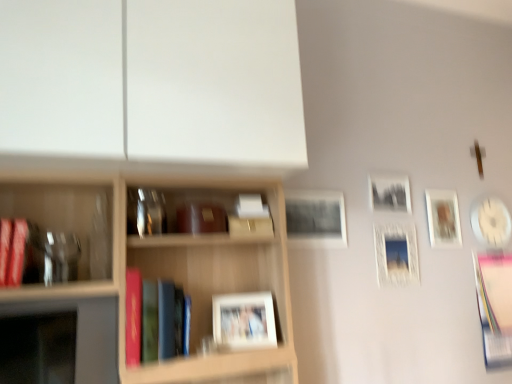
Locate an element on the screen. Image resolution: width=512 pixels, height=384 pixels. matte wooden picture frame at upper right, marked as the 2th picture frame in a right-to-left arrangement is located at coordinates (443, 218).

Locate an element on the screen. Image resolution: width=512 pixels, height=384 pixels. wooden shelf at upper left is located at coordinates (151, 85).

Where is `pink paper book at right, the 1th book in the right-to-left sequence`? The image size is (512, 384). pink paper book at right, the 1th book in the right-to-left sequence is located at coordinates (495, 307).

The width and height of the screenshot is (512, 384). Identify the location of hardcover book at center, which ranks as the second book in left-to-right order. click(x=155, y=319).

Where is `matte wooden picture frame at upper right, marked as the 5th picture frame in a front-to-back arrangement`? This screenshot has width=512, height=384. matte wooden picture frame at upper right, marked as the 5th picture frame in a front-to-back arrangement is located at coordinates (443, 218).

Identify the location of picture frame that is the 3rd object located above the matte white picture frame at center, acting as the first picture frame starting from the left (from the image's perspective). (443, 218).

Is matte white picture frame at center, acting as the first picture frame starting from the left, looking in the opposite direction of matte wooden picture frame at upper right, which is the 2th picture frame in back-to-front order?

No.

Between matte white picture frame at center, the sixth picture frame positioned from the back, and matte wooden picture frame at upper right, marked as the 2th picture frame in a right-to-left arrangement, which one has less height?

matte white picture frame at center, the sixth picture frame positioned from the back, is shorter.

Looking at this image, is matte white picture frame at center, acting as the first picture frame starting from the left, not close to matte wooden picture frame at upper right, marked as the 5th picture frame in a front-to-back arrangement?

Yes.

Which is closer, (478, 214) or (323, 232)?

Positioned in front is point (323, 232).

Consider the image. From a real-world perspective, which is physically above, white glossy picture frame at upper right, the 6th picture frame when ordered from front to back, or matte black picture frame at center, which is the second picture frame from front to back?

matte black picture frame at center, which is the second picture frame from front to back, from a real-world perspective.

Does white glossy picture frame at upper right, the first picture frame viewed from the right, have a greater height compared to matte black picture frame at center, which is the fifth picture frame in back-to-front order?

Yes, white glossy picture frame at upper right, the first picture frame viewed from the right, is taller than matte black picture frame at center, which is the fifth picture frame in back-to-front order.

Does white glossy picture frame at upper right, which appears as the 6th picture frame when viewed from the left, turn towards matte black picture frame at center, which is the second picture frame from front to back?

No.

From the image's perspective, is matte wooden picture frame at upper right, positioned as the 5th picture frame in left-to-right order, above matte white picture frame at center, placed as the first picture frame when sorted from front to back?

Yes, from the image's perspective, matte wooden picture frame at upper right, positioned as the 5th picture frame in left-to-right order, is on top of matte white picture frame at center, placed as the first picture frame when sorted from front to back.

Does matte wooden picture frame at upper right, marked as the 5th picture frame in a front-to-back arrangement, lie behind matte white picture frame at center, the sixth picture frame positioned from the back?

That is True.

Between matte wooden picture frame at upper right, marked as the 5th picture frame in a front-to-back arrangement, and matte white picture frame at center, placed as the first picture frame when sorted from front to back, which one appears on the left side from the viewer's perspective?

matte white picture frame at center, placed as the first picture frame when sorted from front to back.

From a real-world perspective, which is physically above, black matte picture frame at upper right, placed as the third picture frame when sorted from left to right, or pink paper book at right, the third book viewed from the left?

black matte picture frame at upper right, placed as the third picture frame when sorted from left to right, from a real-world perspective.

Which is more to the right, black matte picture frame at upper right, marked as the 4th picture frame in a right-to-left arrangement, or pink paper book at right, the 1th book in the right-to-left sequence?

pink paper book at right, the 1th book in the right-to-left sequence.

In the scene shown: How different are the orientations of black matte picture frame at upper right, marked as the third picture frame in a back-to-front arrangement, and pink paper book at right, the third book viewed from the left, in degrees?

0.927 degrees.

Would you say pink paper book at right, the 1th book in the right-to-left sequence, is part of black matte picture frame at upper right, which ranks as the fourth picture frame in front-to-back order,'s contents?

That's incorrect, pink paper book at right, the 1th book in the right-to-left sequence, is not inside black matte picture frame at upper right, which ranks as the fourth picture frame in front-to-back order.

Measure the distance from matte red book at left, arranged as the first book when viewed from the left, to black matte picture frame at upper right, marked as the 4th picture frame in a right-to-left arrangement.

The distance of matte red book at left, arranged as the first book when viewed from the left, from black matte picture frame at upper right, marked as the 4th picture frame in a right-to-left arrangement, is 1.52 meters.

From the image's perspective, is matte red book at left, arranged as the first book when viewed from the left, below black matte picture frame at upper right, marked as the third picture frame in a back-to-front arrangement?

Answer: Correct, matte red book at left, arranged as the first book when viewed from the left, appears lower than black matte picture frame at upper right, marked as the third picture frame in a back-to-front arrangement, in the image.

Can you confirm if matte red book at left, marked as the first book in a front-to-back arrangement, is positioned to the right of black matte picture frame at upper right, marked as the 4th picture frame in a right-to-left arrangement?

No, matte red book at left, marked as the first book in a front-to-back arrangement, is not to the right of black matte picture frame at upper right, marked as the 4th picture frame in a right-to-left arrangement.

Is matte red book at left, the third book viewed from the back, in front of or behind black matte picture frame at upper right, placed as the third picture frame when sorted from left to right, in the image?

Clearly, matte red book at left, the third book viewed from the back, is in front of black matte picture frame at upper right, placed as the third picture frame when sorted from left to right.

Which is in front, point (446, 229) or point (504, 246)?

Point (446, 229)

Considering the sizes of objects matte wooden picture frame at upper right, positioned as the 5th picture frame in left-to-right order, and white glossy picture frame at upper right, the 6th picture frame when ordered from front to back, in the image provided, who is wider, matte wooden picture frame at upper right, positioned as the 5th picture frame in left-to-right order, or white glossy picture frame at upper right, the 6th picture frame when ordered from front to back,?

white glossy picture frame at upper right, the 6th picture frame when ordered from front to back, is wider.

Is matte wooden picture frame at upper right, marked as the 5th picture frame in a front-to-back arrangement, oriented away from white glossy picture frame at upper right, the first picture frame viewed from the right?

matte wooden picture frame at upper right, marked as the 5th picture frame in a front-to-back arrangement, does not have its back to white glossy picture frame at upper right, the first picture frame viewed from the right.

Is white glossy picture frame at upper right, the 6th picture frame when ordered from front to back, a part of matte wooden picture frame at upper right, positioned as the 5th picture frame in left-to-right order?

No, white glossy picture frame at upper right, the 6th picture frame when ordered from front to back, is located outside of matte wooden picture frame at upper right, positioned as the 5th picture frame in left-to-right order.

In terms of size, does pink paper book at right, marked as the first book in a back-to-front arrangement, appear bigger or smaller than matte white picture frame at center, acting as the first picture frame starting from the left?

In the image, pink paper book at right, marked as the first book in a back-to-front arrangement, appears to be larger than matte white picture frame at center, acting as the first picture frame starting from the left.

Is pink paper book at right, the 1th book in the right-to-left sequence, to the left or to the right of matte white picture frame at center, acting as the sixth picture frame starting from the right, in the image?

pink paper book at right, the 1th book in the right-to-left sequence, is positioned on matte white picture frame at center, acting as the sixth picture frame starting from the right,'s right side.

Which point is more distant from viewer, (500,265) or (233,306)?

The point (500,265) is farther from the camera.

From a real-world perspective, count 3rd picture frames downward from the matte wooden picture frame at upper right, positioned as the 5th picture frame in left-to-right order, and point to it. Please provide its 2D coordinates.

[(244, 320)]

I want to click on picture frame that is the 2nd object located above the white glossy picture frame at upper right, which appears as the 6th picture frame when viewed from the left (from the image's perspective), so click(x=315, y=219).

Which object lies further to the anchor point pink paper book at right, the 1th book in the right-to-left sequence, matte black picture frame at center, which is the fifth picture frame in back-to-front order, or wooden shelf at upper left?

wooden shelf at upper left lies further to pink paper book at right, the 1th book in the right-to-left sequence, than the other object.

When comparing their distances from white glossy picture frame at upper right, which appears as the 6th picture frame when viewed from the left, does wooden shelf at upper left or hardcover book at center, which ranks as the 2th book in front-to-back order, seem closer?

Based on the image, wooden shelf at upper left appears to be nearer to white glossy picture frame at upper right, which appears as the 6th picture frame when viewed from the left.

Based on their spatial positions, is pink paper book at right, the third book viewed from the left, or wooden shelf at upper left further from hardcover book at center, which ranks as the 2th book in front-to-back order?

A: pink paper book at right, the third book viewed from the left.

From the image, which object appears to be farther from black matte picture frame at upper right, marked as the 4th picture frame in a right-to-left arrangement, matte black picture frame at center, which is the fifth picture frame in back-to-front order, or pink paper book at right, the third book viewed from the left?

pink paper book at right, the third book viewed from the left, lies further to black matte picture frame at upper right, marked as the 4th picture frame in a right-to-left arrangement, than the other object.

From the image, which object appears to be farther from matte black picture frame at center, the 5th picture frame when ordered from right to left, pink paper book at right, marked as the first book in a back-to-front arrangement, or white glossy picture frame at upper right, positioned as the 1th picture frame in back-to-front order?

The object further to matte black picture frame at center, the 5th picture frame when ordered from right to left, is pink paper book at right, marked as the first book in a back-to-front arrangement.

Estimate the real-world distances between objects in this image. Which object is further from pink paper book at right, the third book viewed from the left, hardcover book at center, which ranks as the 2th book in front-to-back order, or matte red book at left, arranged as the first book when viewed from the left?

matte red book at left, arranged as the first book when viewed from the left, is further to pink paper book at right, the third book viewed from the left.

Estimate the real-world distances between objects in this image. Which object is closer to white glossy picture frame at upper right, positioned as the 1th picture frame in back-to-front order, white glossy picture frame at upper right, which is counted as the 4th picture frame, starting from the left, or hardcover book at center, which ranks as the 2th book in front-to-back order?

Among the two, white glossy picture frame at upper right, which is counted as the 4th picture frame, starting from the left, is located nearer to white glossy picture frame at upper right, positioned as the 1th picture frame in back-to-front order.

Which object lies further to the anchor point matte wooden picture frame at upper right, marked as the 2th picture frame in a right-to-left arrangement, hardcover book at center, marked as the 2th book in a back-to-front arrangement, or matte red book at left, which is the third book in right-to-left order?

Among the two, matte red book at left, which is the third book in right-to-left order, is located further to matte wooden picture frame at upper right, marked as the 2th picture frame in a right-to-left arrangement.

The image size is (512, 384). I want to click on book between wooden shelf at upper left and black matte picture frame at upper right, marked as the 4th picture frame in a right-to-left arrangement, so click(x=155, y=319).

The image size is (512, 384). Identify the location of book between wooden shelf at upper left and white glossy picture frame at upper right, the 6th picture frame when ordered from front to back. (155, 319).

I want to click on book between matte red book at left, arranged as the first book when viewed from the left, and matte white picture frame at center, placed as the first picture frame when sorted from front to back, in the horizontal direction, so (x=155, y=319).

I want to click on picture frame between matte red book at left, arranged as the first book when viewed from the left, and matte black picture frame at center, the 5th picture frame when ordered from right to left, so tap(244, 320).